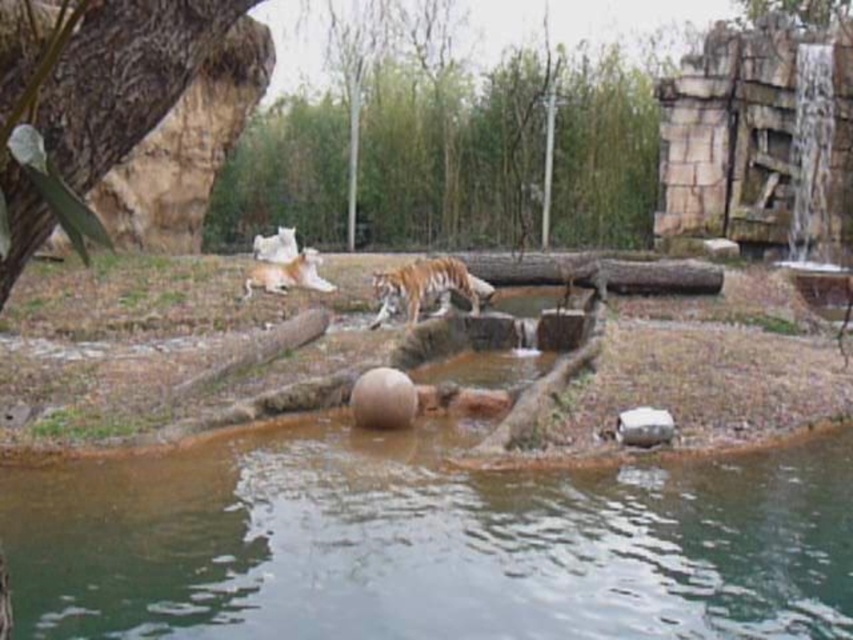
Can you confirm if brown wood tree at upper center is taller than orange striped fur tiger at center?

Yes.

Who is positioned more to the left, brown wood tree at upper center or orange striped fur tiger at center?

From the viewer's perspective, brown wood tree at upper center appears more on the left side.

Between point (296, 131) and point (457, 292), which one is positioned behind?

The point (296, 131) is more distant.

You are a GUI agent. You are given a task and a screenshot of the screen. Output one action in this format:
    pyautogui.click(x=<x>, y=<y>)
    Task: Click on the brown wood tree at upper center
    
    Given the screenshot: What is the action you would take?
    pyautogui.click(x=505, y=150)

From the picture: Which is more to the right, rough bark tree at upper left or orange striped fur tiger at center?

orange striped fur tiger at center is more to the right.

Between point (113, 36) and point (445, 284), which one is positioned in front?

Point (113, 36)

Which is behind, point (177, 70) or point (439, 266)?

Positioned behind is point (439, 266).

Where is `rough bark tree at upper left`? rough bark tree at upper left is located at coordinates (125, 77).

Who is positioned more to the right, orange striped fur tiger at center or orange fur tiger at center?

orange striped fur tiger at center

Is point (445, 291) farther from camera compared to point (311, 268)?

No.

Is point (393, 289) more distant than point (265, 264)?

No, (393, 289) is closer to viewer.

At what (x,y) coordinates should I click in order to perform the action: click on orange striped fur tiger at center. Please return your answer as a coordinate pair (x, y). Looking at the image, I should click on (426, 285).